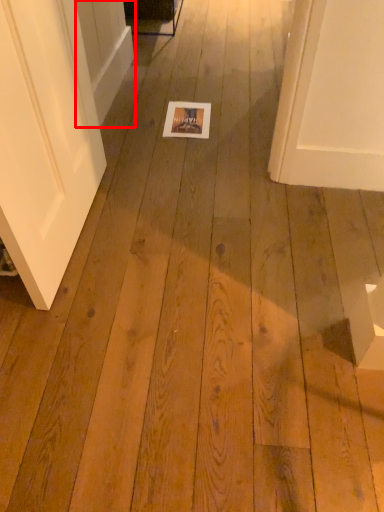
Question: From the image, what is the correct spatial relationship of screen door (annotated by the red box) in relation to postcard?

Choices:
 (A) left
 (B) right

Answer: (A)